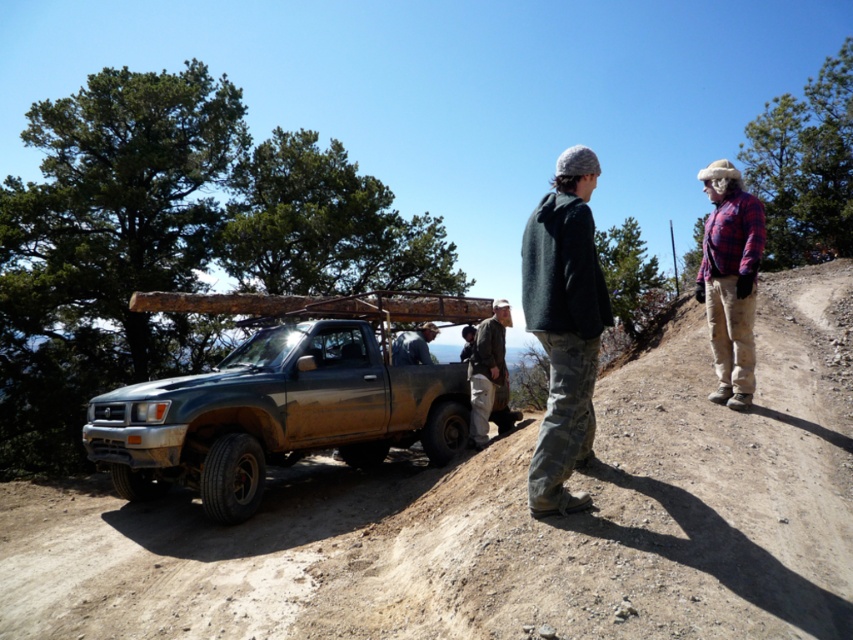
Question: Which object is positioned farthest from the brown dirt track at lower center?

Choices:
 (A) dark gray fabric jacket at center
 (B) dirty metallic pickup truck at center

Answer: (A)

Question: Can you confirm if dark gray fleece jacket at center is smaller than dark gray fabric jacket at center?

Choices:
 (A) yes
 (B) no

Answer: (B)

Question: Does plaid flannel shirt at center appear on the right side of brown canvas jacket at center?

Choices:
 (A) no
 (B) yes

Answer: (B)

Question: Does dark gray fleece jacket at center have a lesser width compared to brown canvas jacket at center?

Choices:
 (A) yes
 (B) no

Answer: (A)

Question: Among these objects, which one is farthest from the camera?

Choices:
 (A) brown canvas jacket at center
 (B) dark gray fabric jacket at center
 (C) plaid flannel shirt at center

Answer: (B)

Question: Considering the real-world distances, which object is closest to the dark gray fleece jacket at center?

Choices:
 (A) brown dirt track at lower center
 (B) dirty metallic pickup truck at center
 (C) plaid flannel shirt at center

Answer: (C)